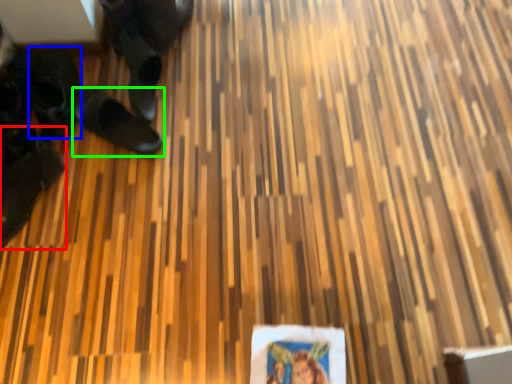
Question: Based on their relative distances, which object is nearer to footwear (highlighted by a red box)? Choose from footwear (highlighted by a blue box) and footwear (highlighted by a green box).

Choices:
 (A) footwear
 (B) footwear

Answer: (A)